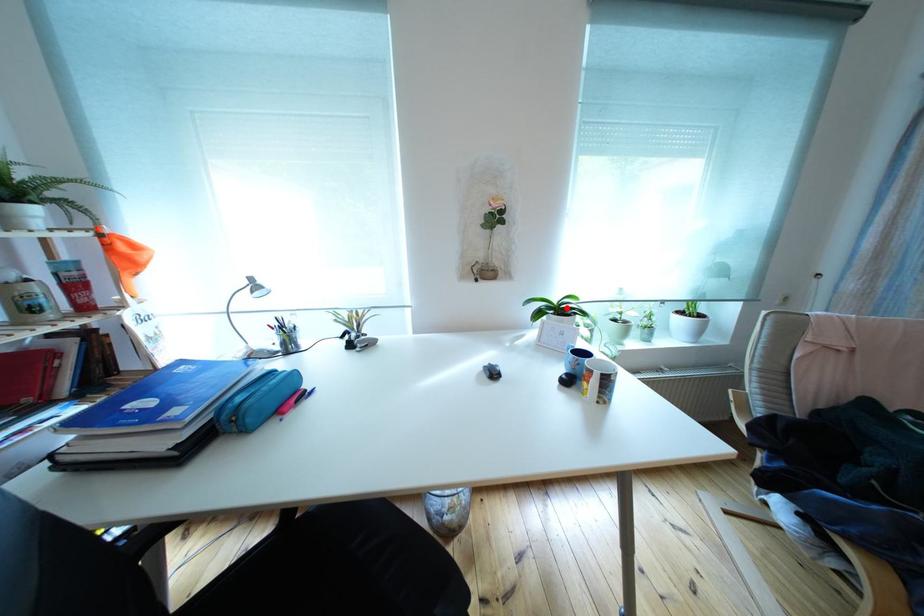
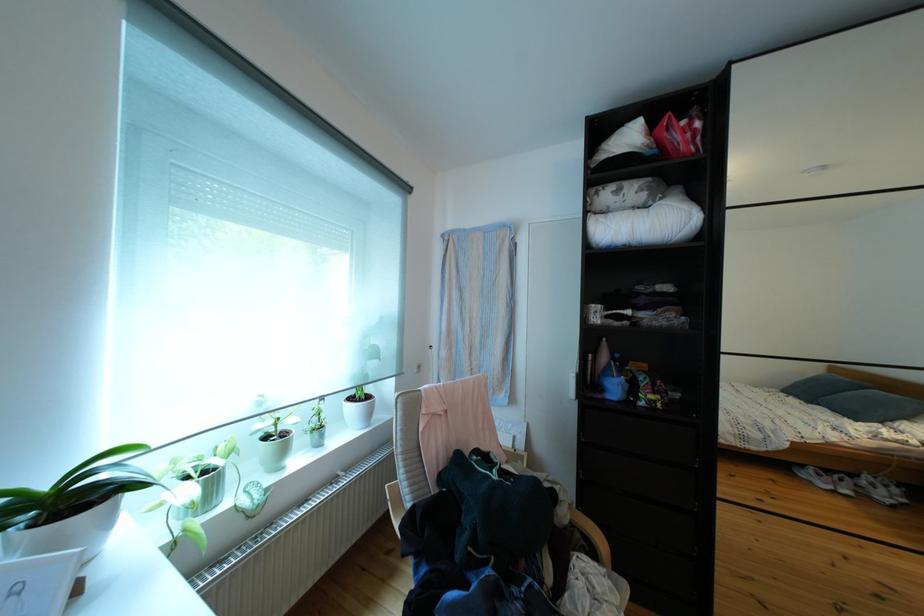
Question: I am providing you with two images of the same scene from different viewpoints. A red point is shown in image1. For the corresponding object point in image2, is it positioned nearer or farther from the camera?

Choices:
 (A) Nearer
 (B) Farther

Answer: (A)